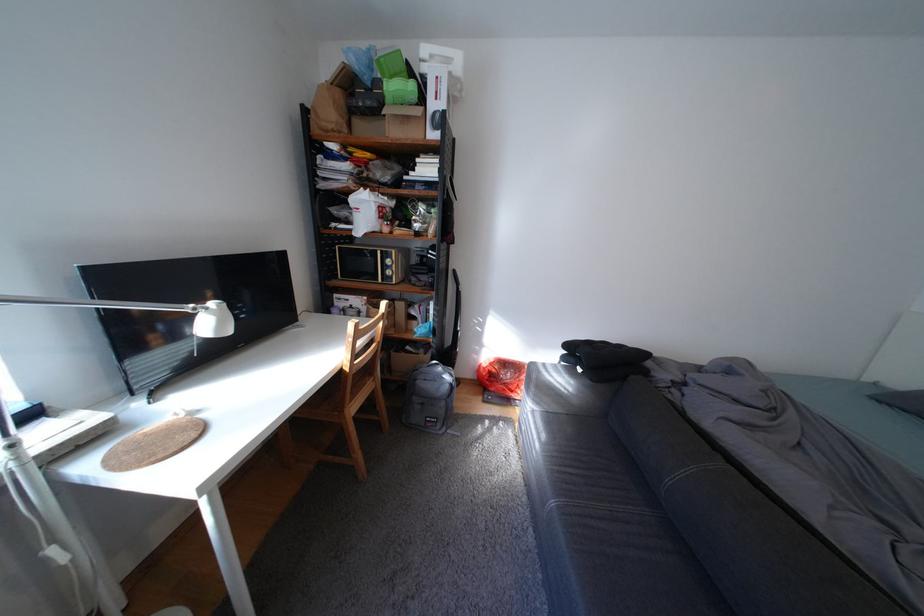
Where is `microwave handle`? The image size is (924, 616). microwave handle is located at coordinates (379, 265).